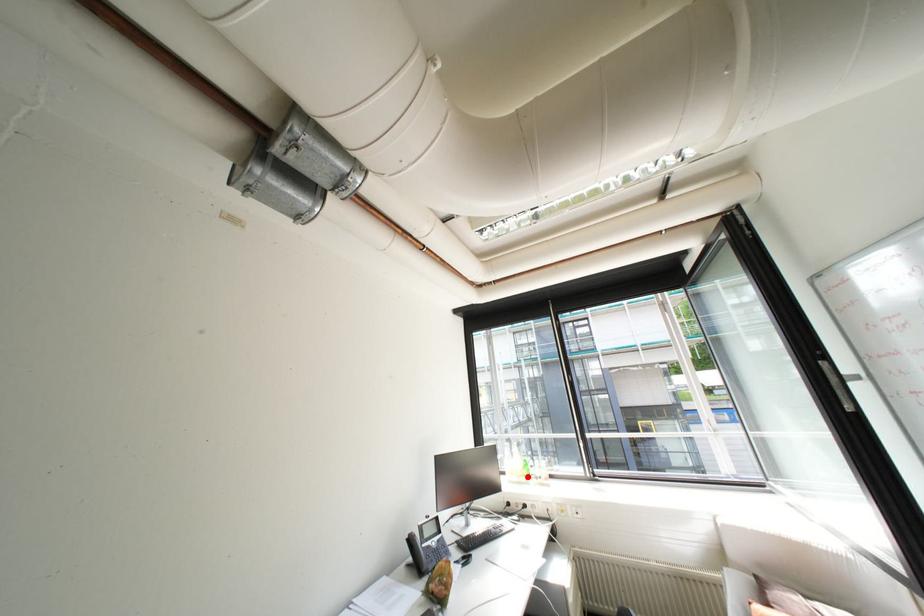
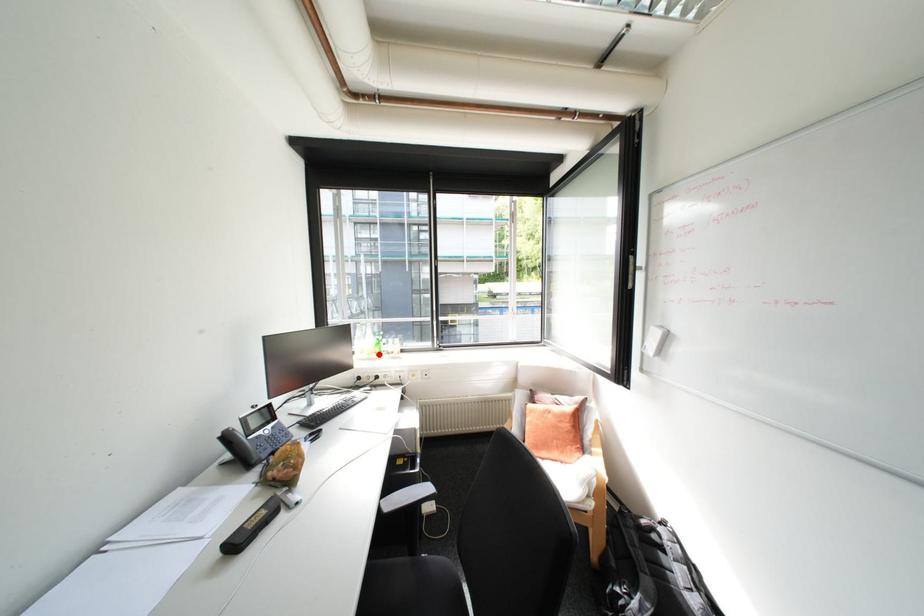
I am providing you with two images of the same scene from different viewpoints. A red point is marked on the first image and another point is marked on the second image. Do the highlighted points in image1 and image2 indicate the same real-world spot?

Yes